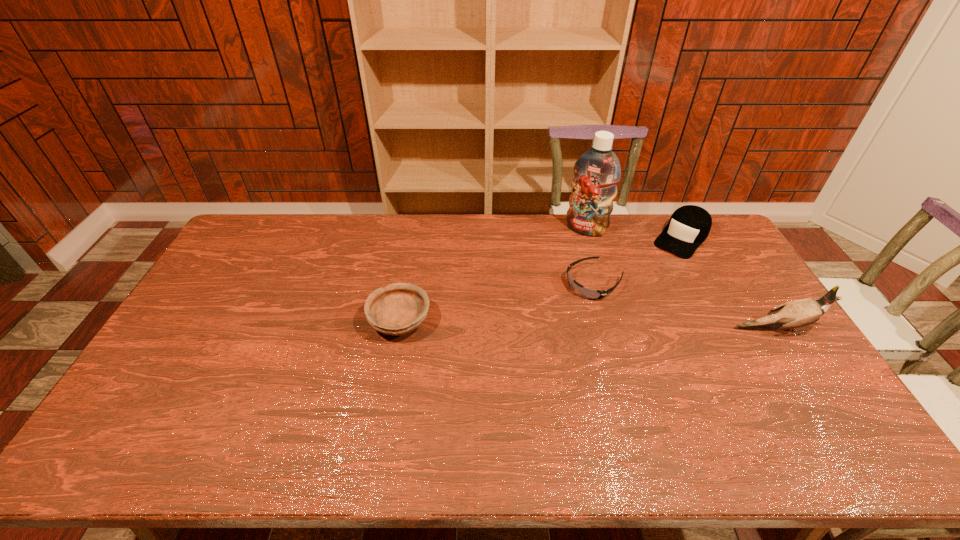
What are the coordinates of `object located in the far right corner section of the desktop` in the screenshot? It's located at (689, 226).

Where is `vacant space at the far edge of the desktop`? The height and width of the screenshot is (540, 960). vacant space at the far edge of the desktop is located at coordinates (450, 221).

Identify the location of free region at the near edge. (335, 410).

The height and width of the screenshot is (540, 960). Identify the location of vacant space at the left edge of the desktop. (241, 261).

You are a GUI agent. You are given a task and a screenshot of the screen. Output one action in this format:
    pyautogui.click(x=<x>, y=<y>)
    Task: Click on the vacant space at the right edge of the desktop
    This screenshot has height=540, width=960.
    Given the screenshot: What is the action you would take?
    pyautogui.click(x=741, y=287)

Where is `free space at the far left corner of the desktop`? The height and width of the screenshot is (540, 960). free space at the far left corner of the desktop is located at coordinates (241, 230).

The height and width of the screenshot is (540, 960). Find the location of `free spot between the fourth shortest object and the third shortest object`. free spot between the fourth shortest object and the third shortest object is located at coordinates (729, 284).

The width and height of the screenshot is (960, 540). Identify the location of vacant space that is in between the cap and the shortest object. (637, 261).

You are a GUI agent. You are given a task and a screenshot of the screen. Output one action in this format:
    pyautogui.click(x=<x>, y=<y>)
    Task: Click on the free space between the tallest object and the shortest object
    
    Given the screenshot: What is the action you would take?
    pyautogui.click(x=590, y=256)

Where is `unoccupied position between the cap and the bird`? unoccupied position between the cap and the bird is located at coordinates (729, 284).